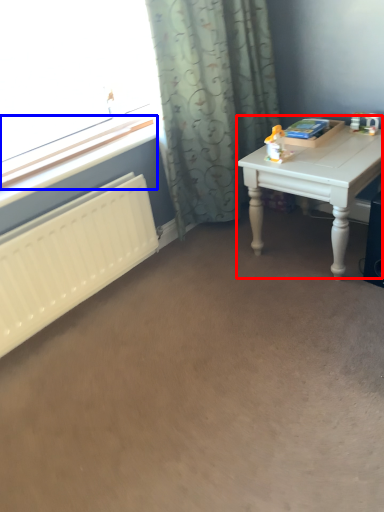
Question: Among these objects, which one is nearest to the camera, table (highlighted by a red box) or window sill (highlighted by a blue box)?

Choices:
 (A) table
 (B) window sill

Answer: (B)